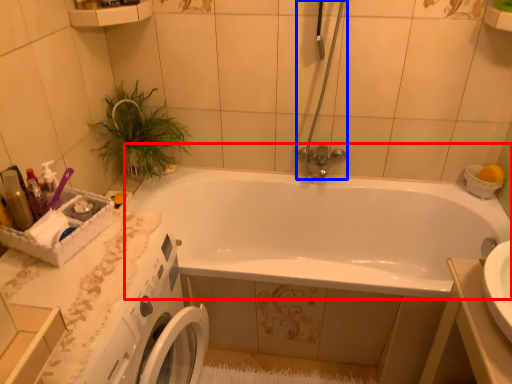
Question: Among these objects, which one is farthest to the camera, bathtub (highlighted by a red box) or shower door (highlighted by a blue box)?

Choices:
 (A) bathtub
 (B) shower door

Answer: (B)